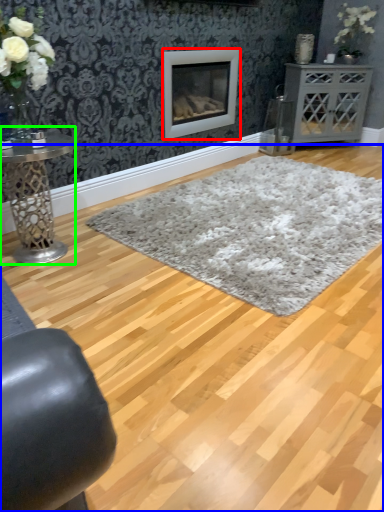
Question: Which object is the farthest from wood burning stove (highlighted by a red box)? Choose among these: plain (highlighted by a blue box) or table (highlighted by a green box).

Choices:
 (A) plain
 (B) table

Answer: (A)